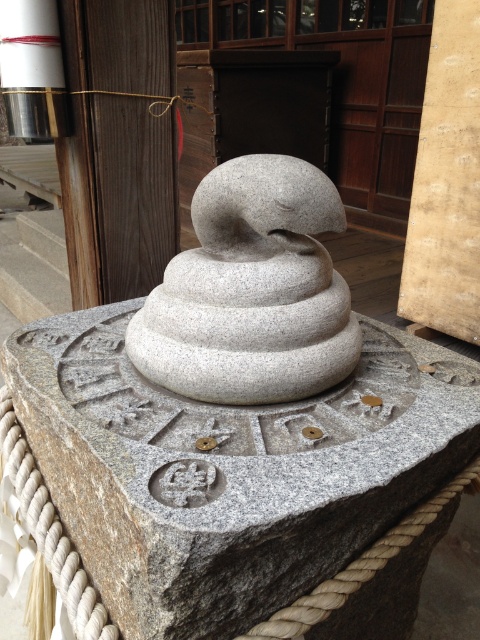
Question: Which point is closer to the camera?

Choices:
 (A) gray stone sculpture at center
 (B) gray stone snake at center
 (C) smooth beige stone at right
 (D) smooth wooden pillar at upper left

Answer: (B)

Question: Based on their relative distances, which object is farther from the smooth beige stone at right?

Choices:
 (A) gray stone sculpture at center
 (B) gray stone snake at center

Answer: (B)

Question: In this image, where is gray stone sculpture at center located relative to smooth wooden pillar at upper left?

Choices:
 (A) left
 (B) right

Answer: (B)

Question: Which object appears closest to the camera in this image?

Choices:
 (A) smooth wooden pillar at upper left
 (B) gray stone snake at center
 (C) smooth beige stone at right

Answer: (B)

Question: Can you confirm if gray stone sculpture at center is thinner than smooth wooden pillar at upper left?

Choices:
 (A) yes
 (B) no

Answer: (B)

Question: Is gray stone snake at center below smooth wooden pillar at upper left?

Choices:
 (A) yes
 (B) no

Answer: (A)